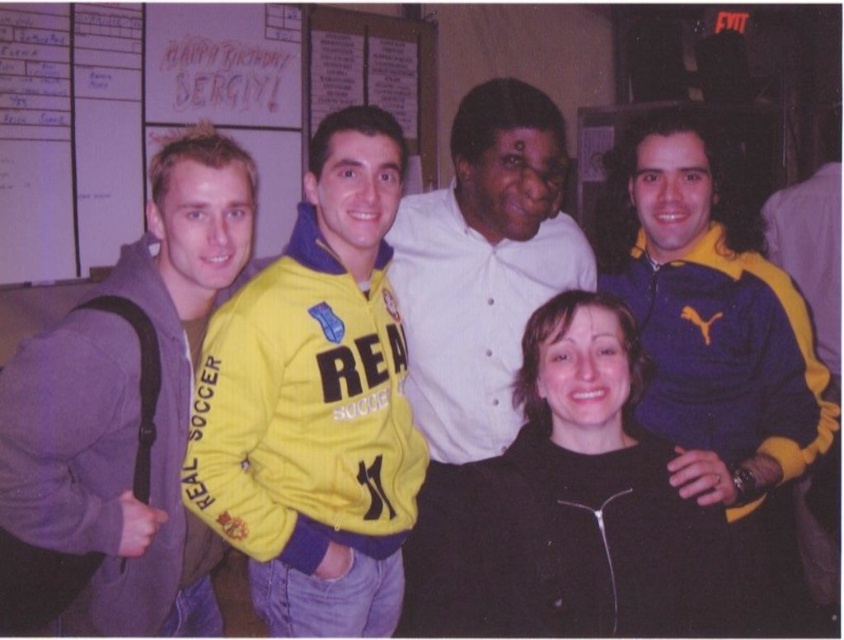
You are trying to decide which clothing item to take from the scene for a costume party. Both the black matte jacket at center and the white shirt at center are available. Based on their sizes, which one would you choose if you want something that covers more of your height?

The white shirt at center is taller than the black matte jacket at center, so you should choose the white shirt at center for better coverage.

You are standing in the room where the group photo is taken. There are two points marked in the image, one at coordinates point (356, 260) and the other at point (565, 310). Which point is closer to you?

Point (356, 260) is further to the viewer than point (565, 310), so the closer point to you is point (565, 310).